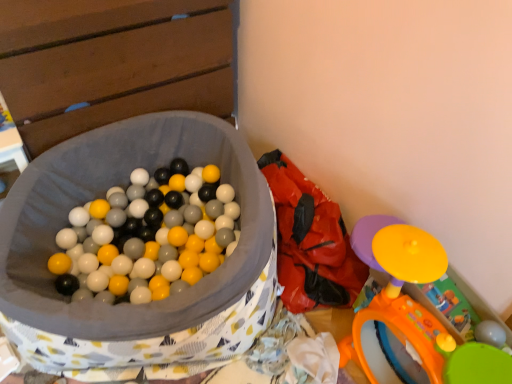
Question: Considering their positions, is red fabric bean bag chair at center located in front of or behind orange plastic toy at lower right?

Choices:
 (A) front
 (B) behind

Answer: (B)

Question: Is red fabric bean bag chair at center taller or shorter than orange plastic toy at lower right?

Choices:
 (A) tall
 (B) short

Answer: (B)

Question: Is red fabric bean bag chair at center bigger or smaller than orange plastic toy at lower right?

Choices:
 (A) big
 (B) small

Answer: (A)

Question: From the image's perspective, is orange plastic toy at lower right above or below red fabric bean bag chair at center?

Choices:
 (A) above
 (B) below

Answer: (B)

Question: Is point (389, 326) closer or farther from the camera than point (286, 190)?

Choices:
 (A) closer
 (B) farther

Answer: (A)

Question: Which is correct: orange plastic toy at lower right is inside red fabric bean bag chair at center, or outside of it?

Choices:
 (A) inside
 (B) outside

Answer: (B)

Question: Looking at the image, does orange plastic toy at lower right seem bigger or smaller compared to red fabric bean bag chair at center?

Choices:
 (A) big
 (B) small

Answer: (B)